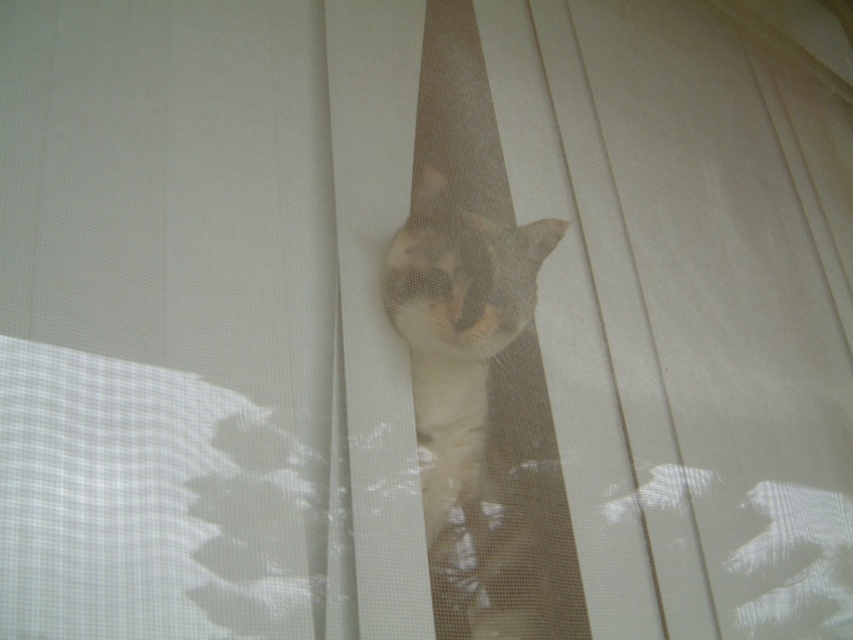
You are a photographer trying to capture a clear photo of the light brown fur cat at center through the white sheer curtain at center. Since the curtain might block some details, can you adjust your position to get a better shot? Explain why or why not based on their positions.

The white sheer curtain at center is closer to the viewer than the light brown fur cat at center. Moving closer to the curtain or adjusting the angle might reduce obstruction, but since the curtain is in front, some obscuring will remain.

You are standing in front of a white curtain with vertical slats and see a cat partially hidden behind it. There are two points marked on the curtain at coordinates point (267,552) and point (474,324). Which point is closer to you?

Point (267,552) is closer to the viewer than point (474,324).